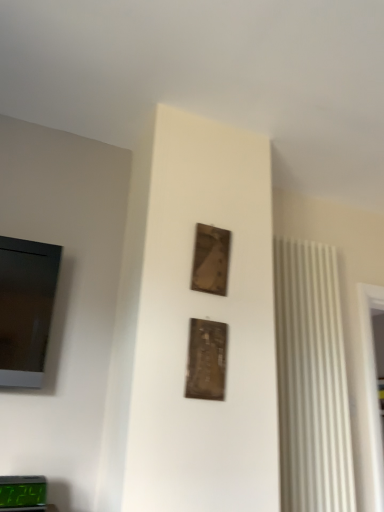
Question: Relative to green digital display at lower left, is wooden frame at upper center, the 2th picture frame positioned from the front, in front or behind?

Choices:
 (A) behind
 (B) front

Answer: (A)

Question: In the image, is wooden frame at upper center, which is the 1th picture frame in top-to-bottom order, on the left side or the right side of green digital display at lower left?

Choices:
 (A) left
 (B) right

Answer: (B)

Question: Estimate the real-world distances between objects in this image. Which object is farther from the wooden frame at upper center, the 2th picture frame positioned from the front?

Choices:
 (A) green digital display at lower left
 (B) metallic gold picture frame at center, arranged as the second picture frame when viewed from the back

Answer: (A)

Question: Which is farther from the green digital display at lower left?

Choices:
 (A) wooden frame at upper center, the 2th picture frame positioned from the front
 (B) metallic gold picture frame at center, the 1th picture frame positioned from the front

Answer: (A)